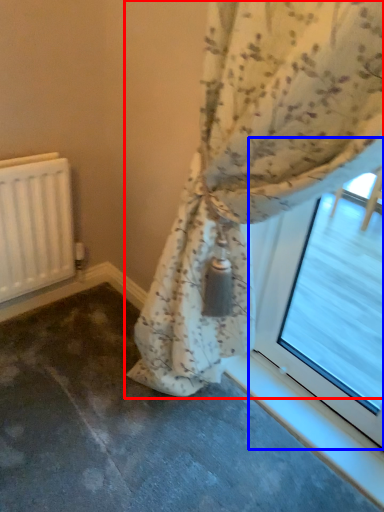
Question: Which object is further to the camera taking this photo, curtain (highlighted by a red box) or bay window (highlighted by a blue box)?

Choices:
 (A) curtain
 (B) bay window

Answer: (B)